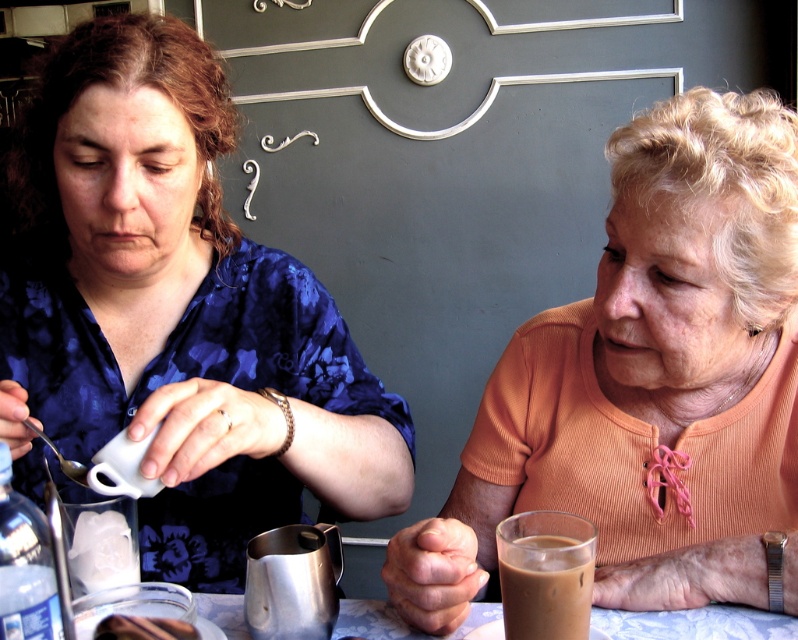
Question: Which is nearer to the metallic silver pitcher at lower center?

Choices:
 (A) brown frothy beverage at lower center
 (B) matte orange blouse at right

Answer: (A)

Question: Can you confirm if metallic silver pitcher at lower center is bigger than brown frothy beverage at lower center?

Choices:
 (A) yes
 (B) no

Answer: (A)

Question: Which point appears farthest from the camera in this image?

Choices:
 (A) (311, 572)
 (B) (78, 44)
 (C) (132, 621)
 (D) (674, 624)

Answer: (B)

Question: Is the position of matte blue blouse at upper left less distant than that of matte orange blouse at right?

Choices:
 (A) yes
 (B) no

Answer: (A)

Question: Can you confirm if matte orange blouse at right is thinner than shiny metallic pitcher at lower center?

Choices:
 (A) yes
 (B) no

Answer: (B)

Question: Which of the following is the farthest from the observer?

Choices:
 (A) brown frothy beverage at lower center
 (B) shiny metallic pitcher at lower center
 (C) matte orange blouse at right

Answer: (C)